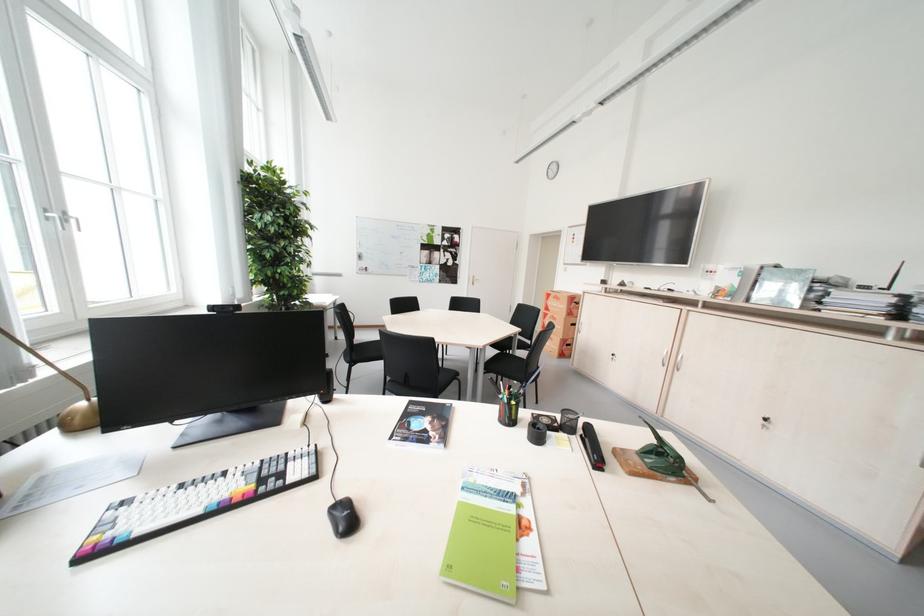
Describe the element at coordinates (68, 221) in the screenshot. I see `a white window handle` at that location.